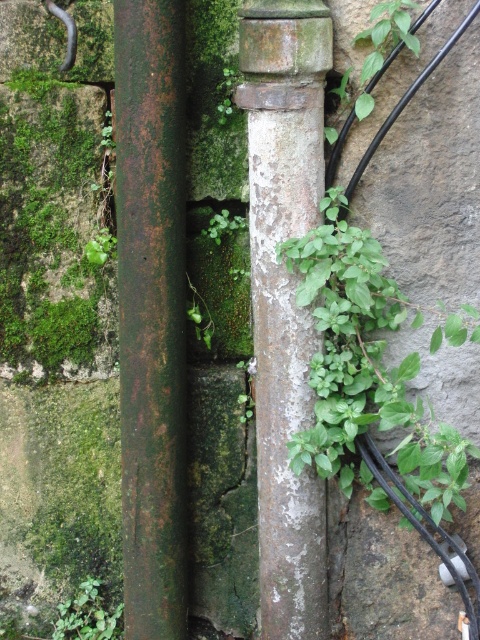
Question: Does rusty metal pole at left come in front of green matte plant at lower left?

Choices:
 (A) no
 (B) yes

Answer: (B)

Question: Which point appears closest to the camera in this image?

Choices:
 (A) (356, 339)
 (B) (113, 624)
 (C) (120, 8)

Answer: (C)

Question: Which object is the farthest from the green leafy plant at center right?

Choices:
 (A) green matte plant at lower left
 (B) rusty metal pole at left
 (C) rusty metal pole at center

Answer: (A)

Question: Which of the following is the farthest from the observer?

Choices:
 (A) green leafy plant at center right
 (B) rusty metal pole at left
 (C) green matte plant at lower left
 (D) rusty metal pole at center

Answer: (C)

Question: Does green leafy plant at center right appear on the left side of green matte plant at lower left?

Choices:
 (A) no
 (B) yes

Answer: (A)

Question: Is green leafy plant at center right positioned in front of green matte plant at lower left?

Choices:
 (A) yes
 (B) no

Answer: (A)